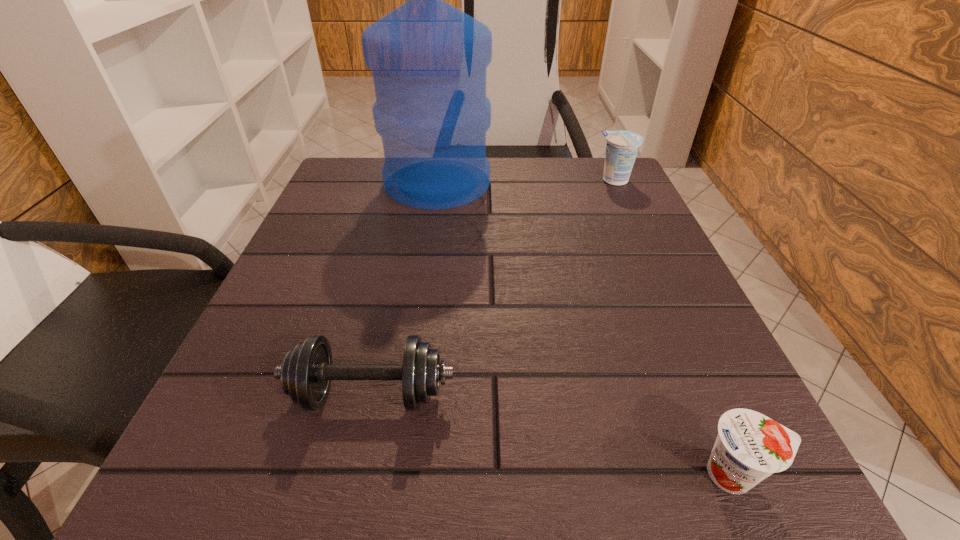
At what (x,y) coordinates should I click in order to perform the action: click on free spot at the near left corner of the desktop. Please return your answer as a coordinate pair (x, y). The height and width of the screenshot is (540, 960). Looking at the image, I should click on (211, 469).

This screenshot has height=540, width=960. Identify the location of vacant space at the far right corner of the desktop. (593, 158).

Identify the location of unoccupied area between the farther yogurt and the water jug. The image size is (960, 540). (526, 181).

At what (x,y) coordinates should I click in order to perform the action: click on free space between the dumbbell and the taller yogurt. Please return your answer as a coordinate pair (x, y). Looking at the image, I should click on (492, 287).

Find the location of `empty space that is in between the water jug and the nearest object`. empty space that is in between the water jug and the nearest object is located at coordinates (586, 328).

This screenshot has width=960, height=540. Identify the location of vacant point located between the tallest object and the nearer yogurt. (586, 328).

Locate an element on the screen. This screenshot has width=960, height=540. free space between the tallest object and the second nearest object is located at coordinates (404, 288).

You are a GUI agent. You are given a task and a screenshot of the screen. Output one action in this format:
    pyautogui.click(x=<x>, y=<y>)
    Task: Click on the vacant area that lies between the tallest object and the taller yogurt
    Image resolution: width=960 pixels, height=540 pixels.
    Given the screenshot: What is the action you would take?
    pyautogui.click(x=526, y=181)

Identify the location of free spot between the farther yogurt and the shorter yogurt. The width and height of the screenshot is (960, 540). (675, 327).

This screenshot has width=960, height=540. I want to click on vacant region between the taller yogurt and the water jug, so coord(526,181).